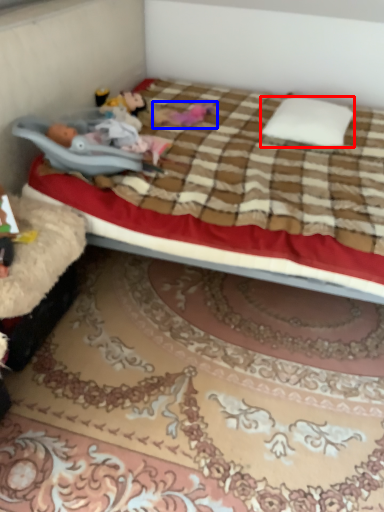
Question: Which object is closer to the camera taking this photo, pillow (highlighted by a red box) or toy (highlighted by a blue box)?

Choices:
 (A) pillow
 (B) toy

Answer: (A)